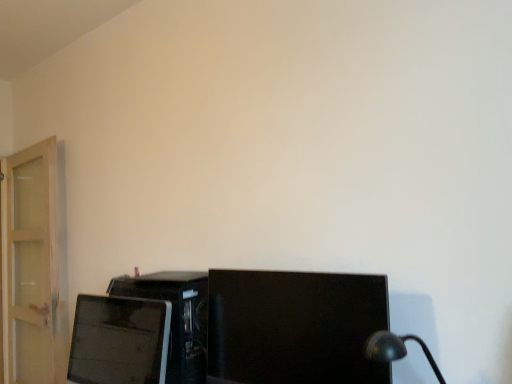
Question: Is matte black desktop computer at lower left positioned beyond the bounds of matte black monitor at lower left, which is counted as the 2th computer monitor, starting from the right?

Choices:
 (A) yes
 (B) no

Answer: (A)

Question: Does matte black desktop computer at lower left touch matte black monitor at lower left, marked as the 1th computer monitor in a left-to-right arrangement?

Choices:
 (A) no
 (B) yes

Answer: (A)

Question: Is matte black desktop computer at lower left taller than matte black monitor at lower left, marked as the 1th computer monitor in a left-to-right arrangement?

Choices:
 (A) no
 (B) yes

Answer: (B)

Question: Is matte black desktop computer at lower left shorter than matte black monitor at lower left, which is counted as the 2th computer monitor, starting from the right?

Choices:
 (A) yes
 (B) no

Answer: (B)

Question: Can you confirm if matte black desktop computer at lower left is bigger than matte black monitor at lower left, which is counted as the 2th computer monitor, starting from the right?

Choices:
 (A) no
 (B) yes

Answer: (B)

Question: Is matte black desktop computer at lower left inside the boundaries of black glossy monitor at center, arranged as the 2th computer monitor when viewed from the left, or outside?

Choices:
 (A) outside
 (B) inside

Answer: (A)

Question: Considering the positions of point (181, 286) and point (290, 380), is point (181, 286) closer or farther from the camera than point (290, 380)?

Choices:
 (A) farther
 (B) closer

Answer: (A)

Question: Looking at the image, does matte black desktop computer at lower left seem bigger or smaller compared to black glossy monitor at center, which appears as the first computer monitor when viewed from the right?

Choices:
 (A) small
 (B) big

Answer: (A)

Question: Is matte black desktop computer at lower left taller or shorter than black glossy monitor at center, arranged as the 2th computer monitor when viewed from the left?

Choices:
 (A) tall
 (B) short

Answer: (A)

Question: Looking at the image, does matte black desktop computer at lower left seem bigger or smaller compared to matte black monitor at lower left, which is counted as the 2th computer monitor, starting from the right?

Choices:
 (A) big
 (B) small

Answer: (A)

Question: Considering the positions of matte black desktop computer at lower left and matte black monitor at lower left, which is counted as the 2th computer monitor, starting from the right, in the image, is matte black desktop computer at lower left wider or thinner than matte black monitor at lower left, which is counted as the 2th computer monitor, starting from the right,?

Choices:
 (A) thin
 (B) wide

Answer: (B)

Question: Do you think matte black desktop computer at lower left is within matte black monitor at lower left, which is counted as the 2th computer monitor, starting from the right, or outside of it?

Choices:
 (A) inside
 (B) outside

Answer: (B)

Question: Based on their positions, is matte black desktop computer at lower left located to the left or right of matte black monitor at lower left, marked as the 1th computer monitor in a left-to-right arrangement?

Choices:
 (A) right
 (B) left

Answer: (A)

Question: Is black glossy monitor at center, which appears as the first computer monitor when viewed from the right, situated inside matte black monitor at lower left, which is counted as the 2th computer monitor, starting from the right, or outside?

Choices:
 (A) outside
 (B) inside

Answer: (A)

Question: Is black glossy monitor at center, which appears as the first computer monitor when viewed from the right, bigger or smaller than matte black monitor at lower left, which is counted as the 2th computer monitor, starting from the right?

Choices:
 (A) big
 (B) small

Answer: (A)